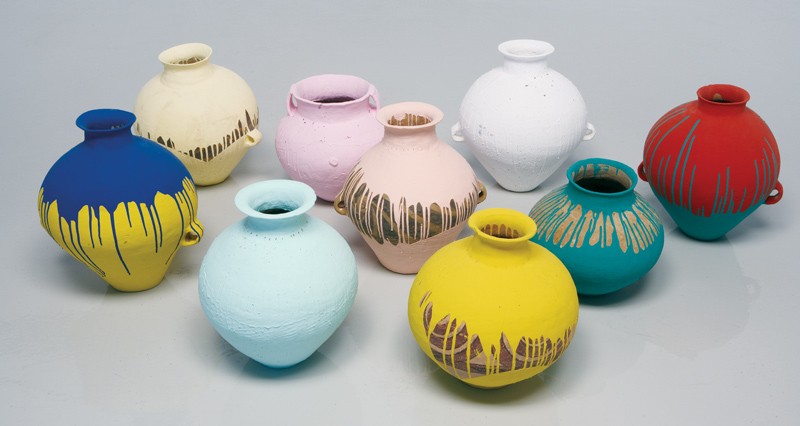
Identify the location of vase. This screenshot has height=426, width=800. (310, 142).